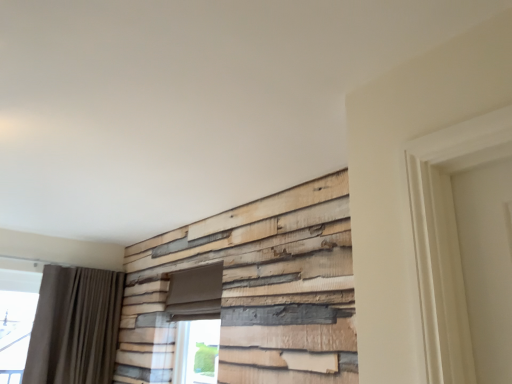
Question: Considering the relative sizes of green glass window at lower center and dark gray fabric curtain at left in the image provided, is green glass window at lower center bigger than dark gray fabric curtain at left?

Choices:
 (A) no
 (B) yes

Answer: (A)

Question: Does green glass window at lower center have a smaller size compared to dark gray fabric curtain at left?

Choices:
 (A) yes
 (B) no

Answer: (A)

Question: Is green glass window at lower center beside dark gray fabric curtain at left?

Choices:
 (A) yes
 (B) no

Answer: (B)

Question: Is green glass window at lower center thinner than dark gray fabric curtain at left?

Choices:
 (A) yes
 (B) no

Answer: (A)

Question: Would you say green glass window at lower center is outside dark gray fabric curtain at left?

Choices:
 (A) no
 (B) yes

Answer: (B)

Question: Is green glass window at lower center positioned behind dark gray fabric curtain at left?

Choices:
 (A) no
 (B) yes

Answer: (A)

Question: From a real-world perspective, is dark gray fabric curtain at left positioned under green glass window at lower center based on gravity?

Choices:
 (A) yes
 (B) no

Answer: (B)

Question: Is dark gray fabric curtain at left surrounding green glass window at lower center?

Choices:
 (A) no
 (B) yes

Answer: (A)

Question: Can you see dark gray fabric curtain at left touching green glass window at lower center?

Choices:
 (A) yes
 (B) no

Answer: (B)

Question: Is dark gray fabric curtain at left not inside green glass window at lower center?

Choices:
 (A) yes
 (B) no

Answer: (A)

Question: Considering the relative sizes of dark gray fabric curtain at left and green glass window at lower center in the image provided, is dark gray fabric curtain at left thinner than green glass window at lower center?

Choices:
 (A) yes
 (B) no

Answer: (B)

Question: Does dark gray fabric curtain at left come behind green glass window at lower center?

Choices:
 (A) no
 (B) yes

Answer: (B)

Question: Visually, is dark gray fabric curtain at left positioned to the left or to the right of green glass window at lower center?

Choices:
 (A) left
 (B) right

Answer: (A)